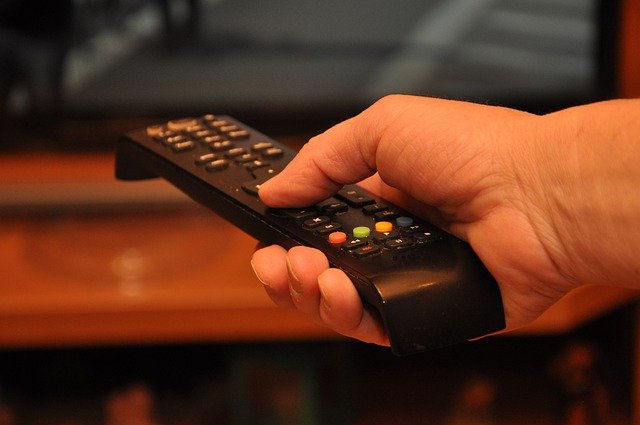
The image size is (640, 425). Find the location of `remote`. remote is located at coordinates (415, 304).